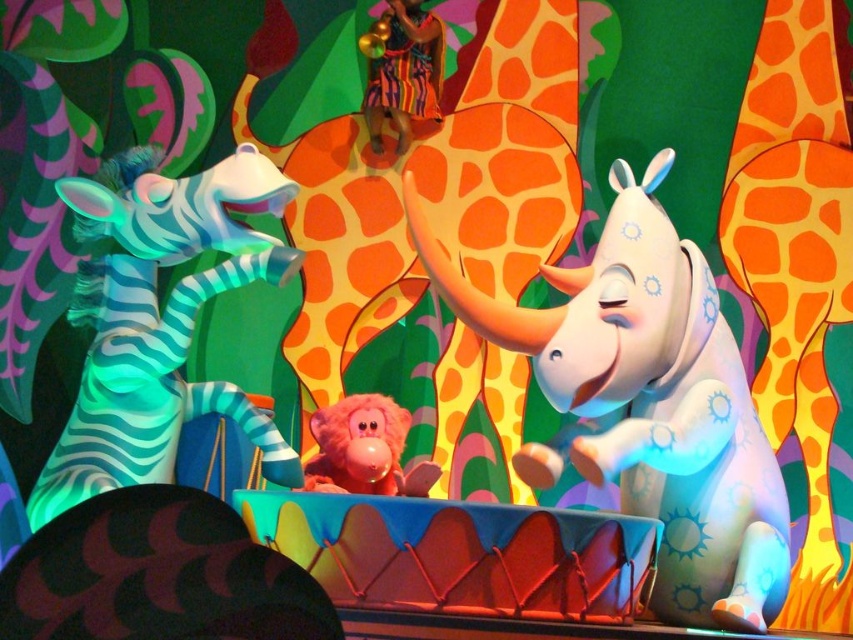
Question: Among these objects, which one is farthest from the camera?

Choices:
 (A) orange spotted giraffe at center
 (B) shiny white rhino at center
 (C) pink plush monkey at center

Answer: (A)

Question: Which point is closer to the camera taking this photo?

Choices:
 (A) pyautogui.click(x=341, y=397)
 (B) pyautogui.click(x=749, y=86)
 (C) pyautogui.click(x=497, y=378)

Answer: (A)

Question: Is orange spotted fabric at right above teal glossy zebra at left?

Choices:
 (A) yes
 (B) no

Answer: (A)

Question: Does shiny white rhino at center appear over teal glossy zebra at left?

Choices:
 (A) yes
 (B) no

Answer: (B)

Question: Among these points, which one is farthest from the camera?

Choices:
 (A) (392, 371)
 (B) (373, 92)
 (C) (820, 108)

Answer: (C)

Question: Can you confirm if orange spotted fabric at right is positioned above pink plush monkey at center?

Choices:
 (A) no
 (B) yes

Answer: (B)